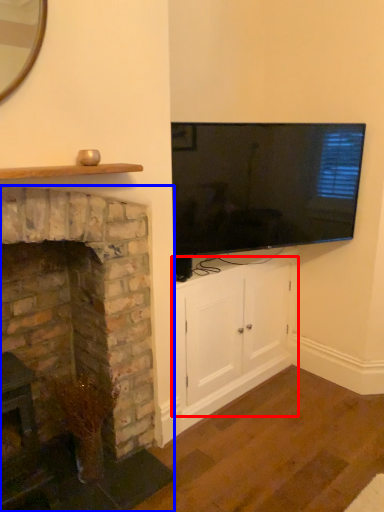
Question: Which point is closer to the camera, cabinetry (highlighted by a red box) or fireplace (highlighted by a blue box)?

Choices:
 (A) cabinetry
 (B) fireplace

Answer: (B)